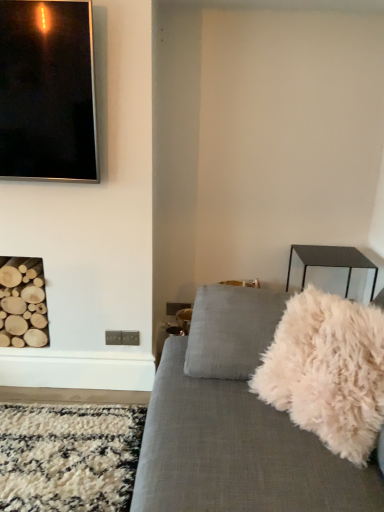
Question: Considering the relative positions of black glossy picture frame at upper left and white fluffy throw pillow at right in the image provided, is black glossy picture frame at upper left to the left of white fluffy throw pillow at right from the viewer's perspective?

Choices:
 (A) yes
 (B) no

Answer: (A)

Question: From a real-world perspective, is black glossy picture frame at upper left on white fluffy throw pillow at right?

Choices:
 (A) yes
 (B) no

Answer: (A)

Question: Would you say black glossy picture frame at upper left is a long distance from white fluffy throw pillow at right?

Choices:
 (A) yes
 (B) no

Answer: (A)

Question: Is black glossy picture frame at upper left outside white fluffy throw pillow at right?

Choices:
 (A) yes
 (B) no

Answer: (A)

Question: From a real-world perspective, is black glossy picture frame at upper left positioned under white fluffy throw pillow at right based on gravity?

Choices:
 (A) yes
 (B) no

Answer: (B)

Question: Can you confirm if black glossy picture frame at upper left is positioned to the right of white fluffy throw pillow at right?

Choices:
 (A) no
 (B) yes

Answer: (A)

Question: Could you tell me if white fluffy throw pillow at right is turned towards black glossy picture frame at upper left?

Choices:
 (A) yes
 (B) no

Answer: (B)

Question: Is white fluffy throw pillow at right smaller than black glossy picture frame at upper left?

Choices:
 (A) no
 (B) yes

Answer: (A)

Question: Is white fluffy throw pillow at right at the right side of black glossy picture frame at upper left?

Choices:
 (A) yes
 (B) no

Answer: (A)

Question: Can you confirm if white fluffy throw pillow at right is taller than black glossy picture frame at upper left?

Choices:
 (A) yes
 (B) no

Answer: (B)

Question: Can black glossy picture frame at upper left be found inside white fluffy throw pillow at right?

Choices:
 (A) yes
 (B) no

Answer: (B)

Question: From a real-world perspective, is white fluffy throw pillow at right located beneath black glossy picture frame at upper left?

Choices:
 (A) no
 (B) yes

Answer: (B)

Question: Is point (352, 398) positioned closer to the camera than point (89, 103)?

Choices:
 (A) farther
 (B) closer

Answer: (B)